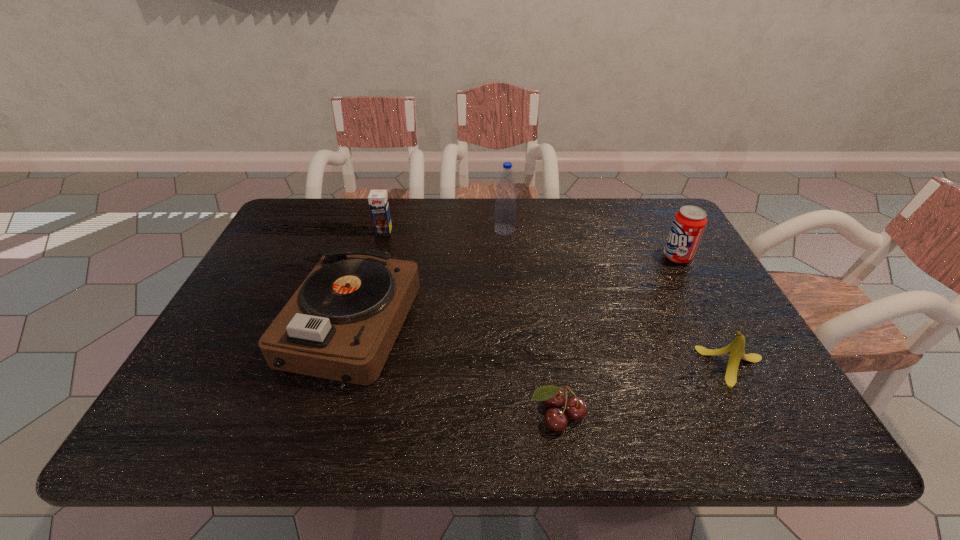
Find the location of `vacant space located 0.190m on the front label of the chocolate milk`. vacant space located 0.190m on the front label of the chocolate milk is located at coordinates (371, 278).

Locate an element on the screen. The height and width of the screenshot is (540, 960). free space located on the right of the record player is located at coordinates (499, 327).

Where is `vacant space located on the left of the banana`? The width and height of the screenshot is (960, 540). vacant space located on the left of the banana is located at coordinates (606, 367).

You are a GUI agent. You are given a task and a screenshot of the screen. Output one action in this format:
    pyautogui.click(x=<x>, y=<y>)
    Task: Click on the water bottle located in the far edge section of the desktop
    
    Given the screenshot: What is the action you would take?
    pyautogui.click(x=505, y=206)

Find the location of `chocolate milk at the far edge`. chocolate milk at the far edge is located at coordinates (378, 201).

The height and width of the screenshot is (540, 960). What are the coordinates of `object located in the near edge section of the desktop` in the screenshot? It's located at (575, 408).

This screenshot has height=540, width=960. In order to click on soda can located in the right edge section of the desktop in this screenshot , I will do `click(689, 222)`.

Locate an element on the screen. banana that is at the right edge is located at coordinates (736, 348).

Image resolution: width=960 pixels, height=540 pixels. Identify the location of vacant space at the far edge of the desktop. (372, 227).

The width and height of the screenshot is (960, 540). Find the location of `free space at the near edge`. free space at the near edge is located at coordinates click(447, 440).